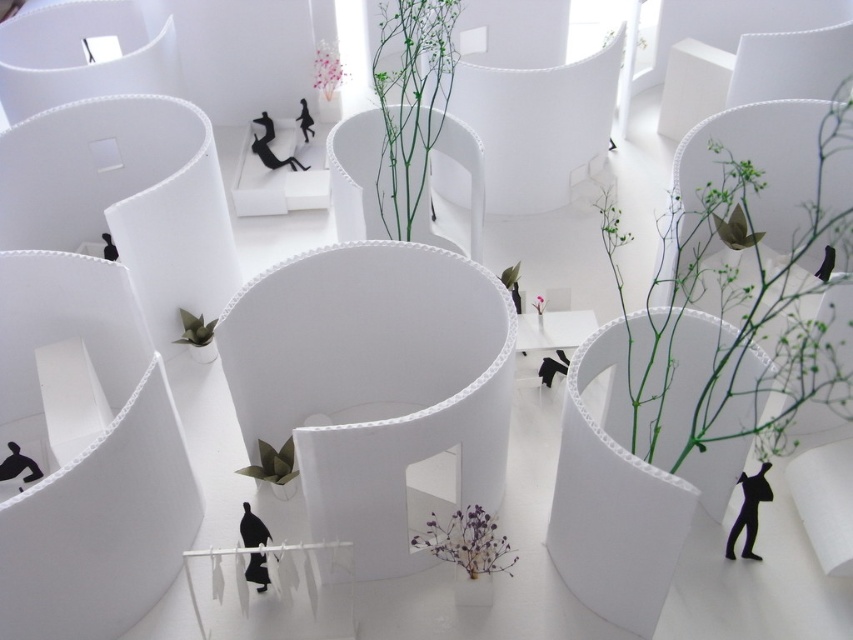
Question: Can you confirm if green matte plant at right is positioned to the right of black matte figure at lower left?

Choices:
 (A) yes
 (B) no

Answer: (A)

Question: Which point appears closest to the camera in this image?

Choices:
 (A) (537, 296)
 (B) (254, 529)

Answer: (B)

Question: Which is nearer to the green stem at center?

Choices:
 (A) pink floral arrangement at upper center
 (B) purple dried flowers at center
 (C) black matte figure at lower center

Answer: (A)

Question: Which of these objects is positioned farthest from the black matte figure at lower center?

Choices:
 (A) pink matte flower at center
 (B) green matte plant at right
 (C) pink floral arrangement at upper center

Answer: (C)

Question: Is green matte plant at right bigger than purple dried flowers at center?

Choices:
 (A) no
 (B) yes

Answer: (B)

Question: Is green matte plant at right in front of pink floral arrangement at upper center?

Choices:
 (A) no
 (B) yes

Answer: (B)